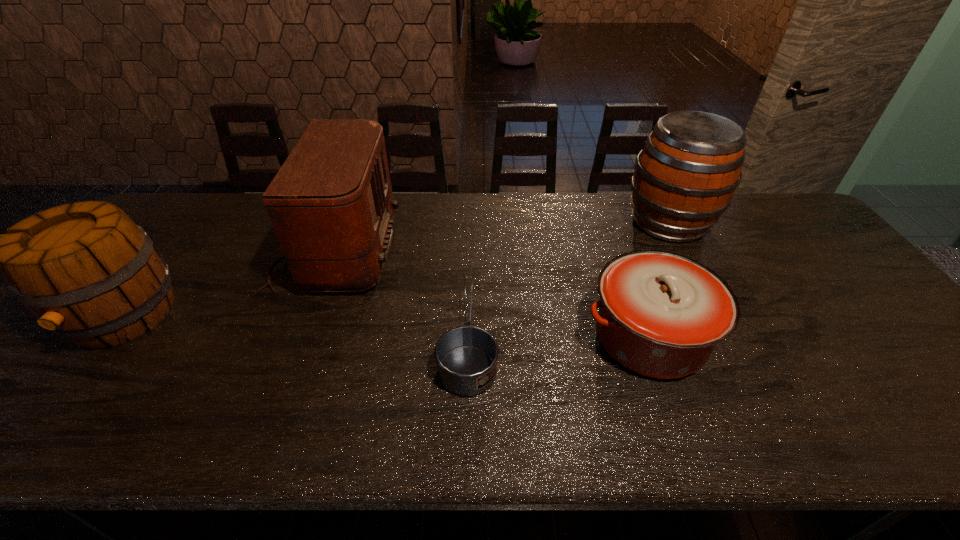
You are a GUI agent. You are given a task and a screenshot of the screen. Output one action in this format:
    pyautogui.click(x=<x>, y=<y>)
    Task: Click on the vacant space located 0.090m on the side of the shorter cider where the spigot is located
    The image size is (960, 540).
    Given the screenshot: What is the action you would take?
    pyautogui.click(x=59, y=397)

Find the location of a particular element. The image size is (960, 540). vacant area located 0.360m on the back of the casserole is located at coordinates (606, 217).

Locate an element on the screen. The height and width of the screenshot is (540, 960). vacant space located 0.310m with the handle extending from one side of the saucepan is located at coordinates (471, 225).

Image resolution: width=960 pixels, height=540 pixels. I want to click on vacant space located with the handle extending from one side of the saucepan, so click(x=470, y=251).

Where is `free region located with the handle extending from one side of the saucepan`? The width and height of the screenshot is (960, 540). free region located with the handle extending from one side of the saucepan is located at coordinates (471, 214).

Image resolution: width=960 pixels, height=540 pixels. Find the location of `cider that is at the far edge`. cider that is at the far edge is located at coordinates (685, 177).

This screenshot has height=540, width=960. I want to click on radio receiver located at the far edge, so click(x=331, y=205).

Image resolution: width=960 pixels, height=540 pixels. What are the coordinates of `object present at the left edge` in the screenshot? It's located at click(86, 271).

The width and height of the screenshot is (960, 540). I want to click on free region at the far edge of the desktop, so click(751, 218).

This screenshot has height=540, width=960. I want to click on free space at the near edge of the desktop, so click(717, 408).